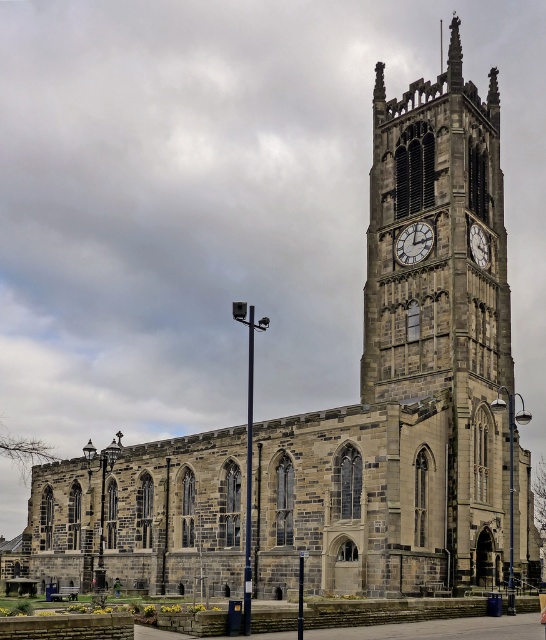
You are an architect analyzing the church layout. You notice the dark gray stone clock tower at center and the stone clock tower at upper center. Which one is taller?

The dark gray stone clock tower at center is much taller than the stone clock tower at upper center.

Consider the image. You are standing in front of the grand stone church and notice two stone clock towers. According to the image, which one is taller between the stone clock tower at center and the stone clock tower at upper center?

The stone clock tower at center is taller than the stone clock tower at upper center.